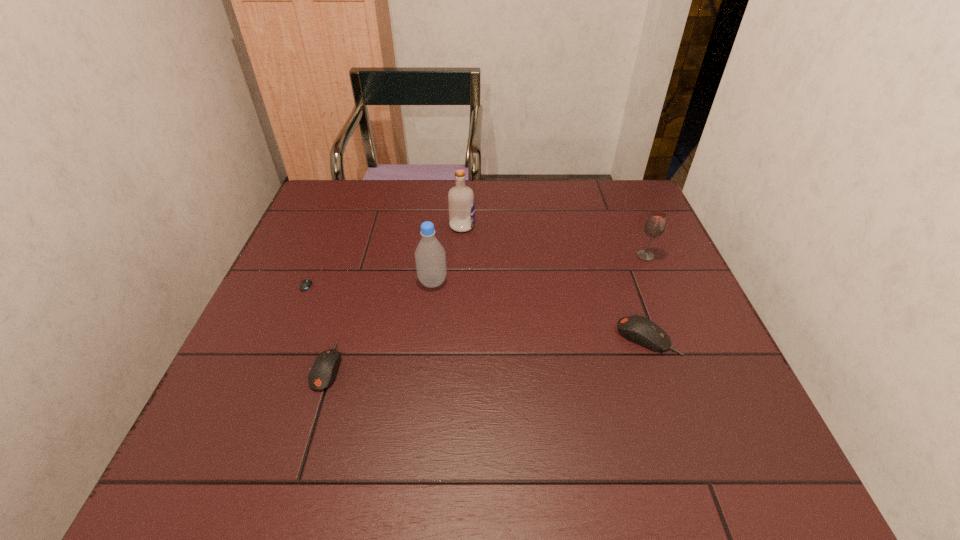
Identify the location of free space between the bottle and the third shortest object. The image size is (960, 540). (540, 309).

What are the coordinates of `free space between the leftmost object and the bottle` in the screenshot? It's located at (372, 281).

You are a GUI agent. You are given a task and a screenshot of the screen. Output one action in this format:
    pyautogui.click(x=<x>, y=<y>)
    Task: Click on the free space that is in between the fifth tallest object and the glass drink container
    This screenshot has height=540, width=960.
    Given the screenshot: What is the action you would take?
    pyautogui.click(x=487, y=311)

This screenshot has width=960, height=540. In order to click on empty location between the fourth shortest object and the leftmost object in this screenshot , I will do `click(478, 268)`.

Locate an element on the screen. empty location between the shortest object and the farthest object is located at coordinates (387, 253).

Identify the location of vacant area that lies between the tallest mouse and the vodka. (555, 281).

Identify the location of free space between the bottle and the second object from left to right. Image resolution: width=960 pixels, height=540 pixels. (380, 324).

Point out which object is positioned as the fourth nearest to the bottle. Please provide its 2D coordinates. Your answer should be formatted as a tuple, i.e. [(x, y)], where the tuple contains the x and y coordinates of a point satisfying the conditions above.

[(638, 329)]

Point out which object is positioned as the fifth nearest to the rightmost mouse. Please provide its 2D coordinates. Your answer should be formatted as a tuple, i.e. [(x, y)], where the tuple contains the x and y coordinates of a point satisfying the conditions above.

[(305, 284)]

Select which mouse is the third closest to the vodka. Please provide its 2D coordinates. Your answer should be formatted as a tuple, i.e. [(x, y)], where the tuple contains the x and y coordinates of a point satisfying the conditions above.

[(638, 329)]